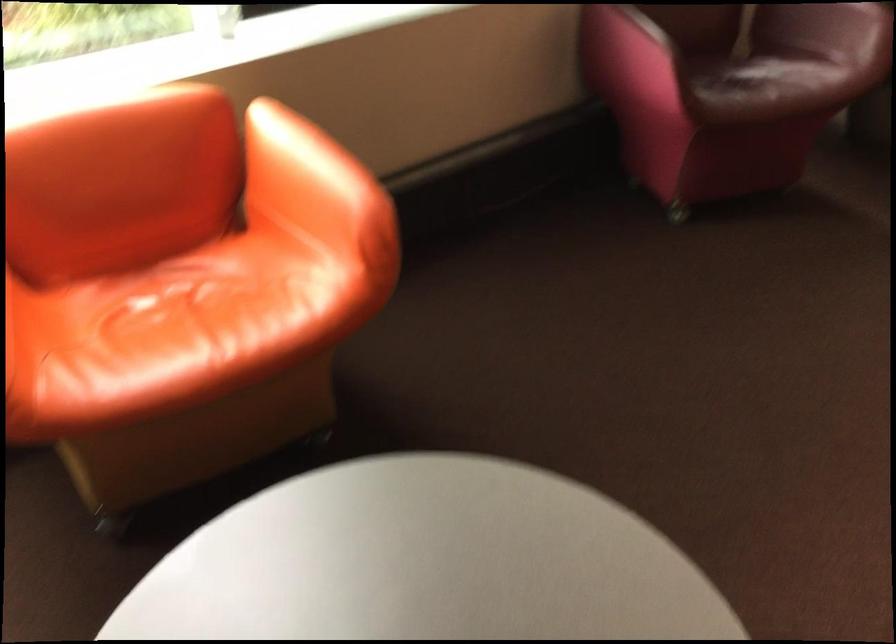
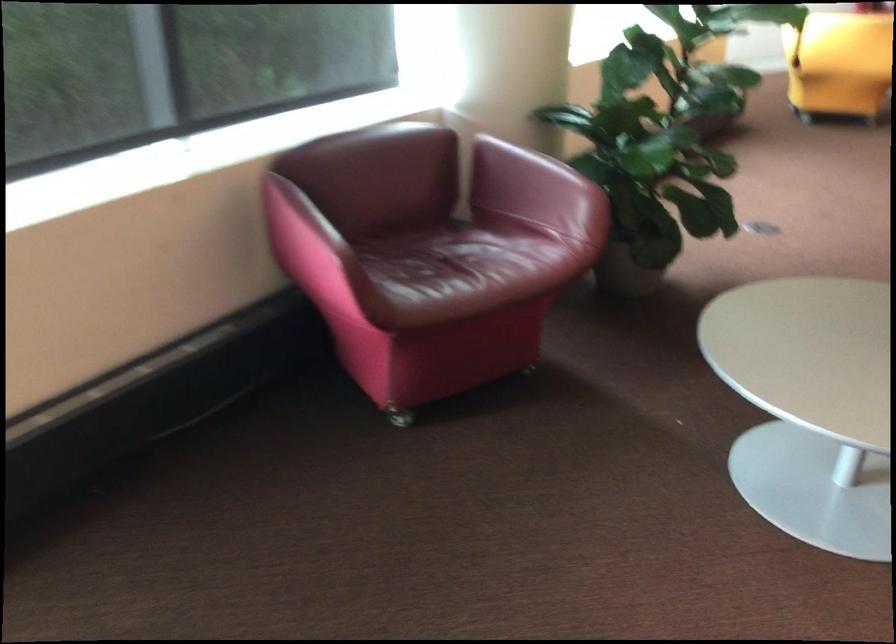
Question: The camera is either moving clockwise (left) or counter-clockwise (right) around the object. The first image is from the beginning of the video and the second image is from the end. Is the camera moving left or right when shooting the video?

Choices:
 (A) Left
 (B) Right

Answer: (A)